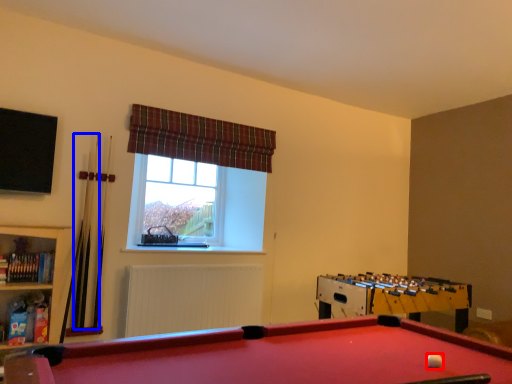
Question: Which object is closer to the camera taking this photo, ball (highlighted by a red box) or cue (highlighted by a blue box)?

Choices:
 (A) ball
 (B) cue

Answer: (A)